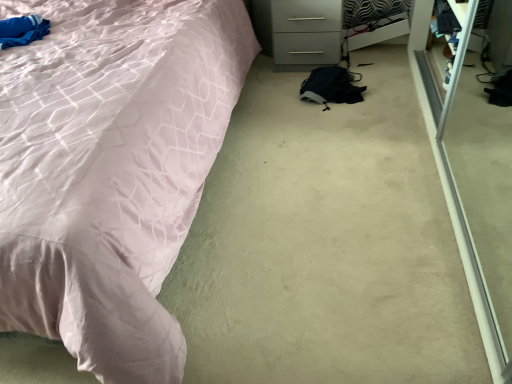
Question: From a real-world perspective, is white glossy drawer at upper right above or below matte pink fabric bed at left?

Choices:
 (A) below
 (B) above

Answer: (A)

Question: In the image, is white glossy drawer at upper right on the left side or the right side of matte pink fabric bed at left?

Choices:
 (A) left
 (B) right

Answer: (B)

Question: From their relative heights in the image, would you say white glossy drawer at upper right is taller or shorter than matte pink fabric bed at left?

Choices:
 (A) short
 (B) tall

Answer: (A)

Question: Would you say matte pink fabric bed at left is inside or outside white glossy drawer at upper right?

Choices:
 (A) outside
 (B) inside

Answer: (A)

Question: Is point (68, 46) positioned closer to the camera than point (287, 44)?

Choices:
 (A) closer
 (B) farther

Answer: (A)

Question: Looking at their shapes, would you say matte pink fabric bed at left is wider or thinner than white glossy drawer at upper right?

Choices:
 (A) thin
 (B) wide

Answer: (B)

Question: From the image's perspective, is matte pink fabric bed at left positioned above or below white glossy drawer at upper right?

Choices:
 (A) below
 (B) above

Answer: (A)